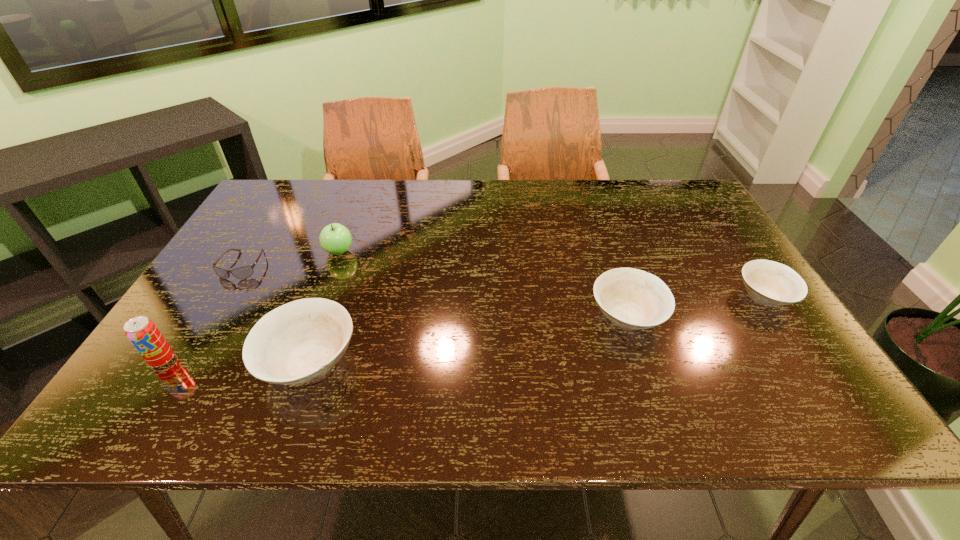
In order to click on location for an additional bowl to make spacing equal in this screenshot , I will do tap(476, 338).